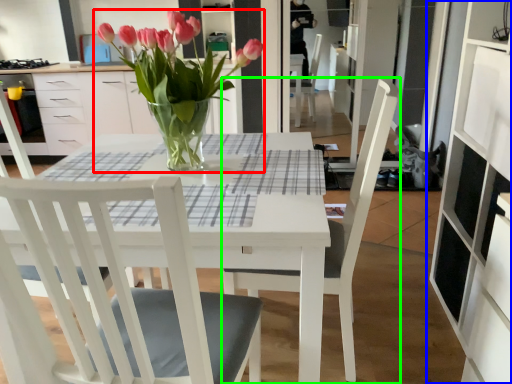
Question: Which object is the farthest from houseplant (highlighted by a red box)? Choose among these: cabinetry (highlighted by a blue box) or chair (highlighted by a green box).

Choices:
 (A) cabinetry
 (B) chair

Answer: (A)